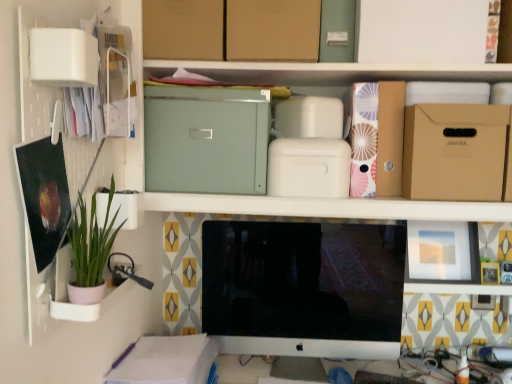
What do you see at coordinates (421, 31) in the screenshot? I see `brown cardboard box at upper right, which appears as the second cardboard box when viewed from the right` at bounding box center [421, 31].

Measure the distance between green matte plant at left and camera.

green matte plant at left and camera are 29.49 inches apart from each other.

Measure the distance between point (252, 49) and camera.

Point (252, 49) and camera are 3.74 feet apart.

Identify the location of matte green metal file cabinet at upper center, the 4th cardboard box positioned from the right. (206, 139).

Where is `white plastic cabinet at upper left`? This screenshot has height=384, width=512. white plastic cabinet at upper left is located at coordinates (116, 79).

Based on their positions, is matte green metal file cabinet at upper center, the 4th cardboard box positioned from the right, located to the left or right of brown cardboard box at upper center, which is the 1th cardboard box from left to right?

Based on their positions, matte green metal file cabinet at upper center, the 4th cardboard box positioned from the right, is located to the right of brown cardboard box at upper center, which is the 1th cardboard box from left to right.

Does point (207, 146) lie behind point (165, 0)?

That is True.

How much distance is there between matte green metal file cabinet at upper center, the second cardboard box from the left, and brown cardboard box at upper center, which is the 1th cardboard box from left to right?

matte green metal file cabinet at upper center, the second cardboard box from the left, and brown cardboard box at upper center, which is the 1th cardboard box from left to right, are 8.34 inches apart from each other.

In terms of width, does matte green metal file cabinet at upper center, the second cardboard box from the left, look wider or thinner when compared to brown cardboard box at upper center, which is the 1th cardboard box from left to right?

Clearly, matte green metal file cabinet at upper center, the second cardboard box from the left, has more width compared to brown cardboard box at upper center, which is the 1th cardboard box from left to right.

Between green matte plant at left and brown cardboard box at upper right, acting as the fourth cardboard box starting from the left, which one has larger width?

brown cardboard box at upper right, acting as the fourth cardboard box starting from the left.

Measure the distance between green matte plant at left and brown cardboard box at upper right, acting as the fourth cardboard box starting from the left.

A distance of 34.48 inches exists between green matte plant at left and brown cardboard box at upper right, acting as the fourth cardboard box starting from the left.

Is green matte plant at left positioned beyond the bounds of brown cardboard box at upper right, acting as the fourth cardboard box starting from the left?

Yes, green matte plant at left is not within brown cardboard box at upper right, acting as the fourth cardboard box starting from the left.

Between green matte plant at left and brown cardboard box at upper right, acting as the fourth cardboard box starting from the left, which one is positioned in front?

green matte plant at left is more forward.

Considering the relative positions of brown cardboard box at upper center, acting as the 5th cardboard box starting from the right, and brown cardboard box at upper center, which is the third cardboard box from left to right, in the image provided, is brown cardboard box at upper center, acting as the 5th cardboard box starting from the right, to the left of brown cardboard box at upper center, which is the third cardboard box from left to right, from the viewer's perspective?

Yes.

Can you confirm if brown cardboard box at upper center, which is the 1th cardboard box from left to right, is smaller than brown cardboard box at upper center, which is the third cardboard box from left to right?

Yes.

Which is in front, brown cardboard box at upper center, which is the 1th cardboard box from left to right, or brown cardboard box at upper center, which is the third cardboard box from left to right?

Positioned in front is brown cardboard box at upper center, which is the third cardboard box from left to right.

Considering the relative positions of brown cardboard box at right, which appears as the 1th cardboard box when viewed from the right, and matte green metal file cabinet at upper center, the 4th cardboard box positioned from the right, in the image provided, is brown cardboard box at right, which appears as the 1th cardboard box when viewed from the right, to the left of matte green metal file cabinet at upper center, the 4th cardboard box positioned from the right, from the viewer's perspective?

In fact, brown cardboard box at right, which appears as the 1th cardboard box when viewed from the right, is to the right of matte green metal file cabinet at upper center, the 4th cardboard box positioned from the right.

Based on the photo, is brown cardboard box at right, which is the 5th cardboard box in left-to-right order, positioned with its back to matte green metal file cabinet at upper center, the 4th cardboard box positioned from the right?

No, brown cardboard box at right, which is the 5th cardboard box in left-to-right order, is not facing away from matte green metal file cabinet at upper center, the 4th cardboard box positioned from the right.

Measure the distance from brown cardboard box at right, which appears as the 1th cardboard box when viewed from the right, to matte green metal file cabinet at upper center, the 4th cardboard box positioned from the right.

brown cardboard box at right, which appears as the 1th cardboard box when viewed from the right, is 21.81 inches from matte green metal file cabinet at upper center, the 4th cardboard box positioned from the right.

Does brown cardboard box at right, which is the 5th cardboard box in left-to-right order, have a larger size compared to matte green metal file cabinet at upper center, the 4th cardboard box positioned from the right?

No, brown cardboard box at right, which is the 5th cardboard box in left-to-right order, is not bigger than matte green metal file cabinet at upper center, the 4th cardboard box positioned from the right.

Is white plastic cabinet at upper left oriented towards brown cardboard box at upper center, acting as the 5th cardboard box starting from the right?

No, white plastic cabinet at upper left is not aimed at brown cardboard box at upper center, acting as the 5th cardboard box starting from the right.

How different are the orientations of white plastic cabinet at upper left and brown cardboard box at upper center, which is the 1th cardboard box from left to right, in degrees?

The angle between the facing direction of white plastic cabinet at upper left and the facing direction of brown cardboard box at upper center, which is the 1th cardboard box from left to right, is 90.7 degrees.

The image size is (512, 384). What are the coordinates of `the 1st cardboard box to the right when counting from the white plastic cabinet at upper left` in the screenshot? It's located at point(184,29).

From a real-world perspective, is white plastic cabinet at upper left beneath brown cardboard box at upper center, acting as the 5th cardboard box starting from the right?

Yes, from a real-world perspective, white plastic cabinet at upper left is under brown cardboard box at upper center, acting as the 5th cardboard box starting from the right.

Is brown cardboard box at upper center, which is the third cardboard box from left to right, positioned with its back to brown cardboard box at upper right, acting as the fourth cardboard box starting from the left?

No, brown cardboard box at upper center, which is the third cardboard box from left to right, is not facing the opposite direction of brown cardboard box at upper right, acting as the fourth cardboard box starting from the left.

Are brown cardboard box at upper center, which is the third cardboard box from left to right, and brown cardboard box at upper right, acting as the fourth cardboard box starting from the left, far apart?

No, there isn't a large distance between brown cardboard box at upper center, which is the third cardboard box from left to right, and brown cardboard box at upper right, acting as the fourth cardboard box starting from the left.

Is brown cardboard box at upper center, acting as the 3th cardboard box starting from the right, wider or thinner than brown cardboard box at upper right, acting as the fourth cardboard box starting from the left?

brown cardboard box at upper center, acting as the 3th cardboard box starting from the right, is thinner than brown cardboard box at upper right, acting as the fourth cardboard box starting from the left.

Where is `cardboard box that is in front of the brown cardboard box at upper center, which is the third cardboard box from left to right`? This screenshot has width=512, height=384. cardboard box that is in front of the brown cardboard box at upper center, which is the third cardboard box from left to right is located at coordinates (421, 31).

Does matte green metal file cabinet at upper center, the second cardboard box from the left, turn towards sleek silver monitor at center?

No, matte green metal file cabinet at upper center, the second cardboard box from the left, is not turned towards sleek silver monitor at center.

Is matte green metal file cabinet at upper center, the second cardboard box from the left, wider than sleek silver monitor at center?

Indeed, matte green metal file cabinet at upper center, the second cardboard box from the left, has a greater width compared to sleek silver monitor at center.

Would you say matte green metal file cabinet at upper center, the 4th cardboard box positioned from the right, is outside sleek silver monitor at center?

Yes, matte green metal file cabinet at upper center, the 4th cardboard box positioned from the right, is located beyond the bounds of sleek silver monitor at center.

Is matte green metal file cabinet at upper center, the 4th cardboard box positioned from the right, with sleek silver monitor at center?

No, matte green metal file cabinet at upper center, the 4th cardboard box positioned from the right, is not beside sleek silver monitor at center.

This screenshot has width=512, height=384. Find the location of `the 3rd cardboard box above when counting from the matte green metal file cabinet at upper center, the second cardboard box from the left (from the image's perspective)`. the 3rd cardboard box above when counting from the matte green metal file cabinet at upper center, the second cardboard box from the left (from the image's perspective) is located at coordinates (184, 29).

Locate an element on the screen. The height and width of the screenshot is (384, 512). plant below the brown cardboard box at upper right, acting as the fourth cardboard box starting from the left (from a real-world perspective) is located at coordinates (92, 241).

When comparing their distances from brown cardboard box at upper right, which appears as the second cardboard box when viewed from the right, does green matte plant at left or brown cardboard box at upper center, acting as the 5th cardboard box starting from the right, seem further?

green matte plant at left.

Based on their spatial positions, is matte green metal file cabinet at upper center, the second cardboard box from the left, or green matte plant at left closer to brown cardboard box at upper center, acting as the 5th cardboard box starting from the right?

Among the two, matte green metal file cabinet at upper center, the second cardboard box from the left, is located nearer to brown cardboard box at upper center, acting as the 5th cardboard box starting from the right.

Which object lies further to the anchor point sleek silver monitor at center, brown cardboard box at upper center, which is the 1th cardboard box from left to right, or white plastic cabinet at upper left?

white plastic cabinet at upper left is positioned further to the anchor sleek silver monitor at center.

Estimate the real-world distances between objects in this image. Which object is further from brown cardboard box at upper center, which is the 1th cardboard box from left to right, green matte plant at left or brown cardboard box at right, which is the 5th cardboard box in left-to-right order?

Based on the image, brown cardboard box at right, which is the 5th cardboard box in left-to-right order, appears to be further to brown cardboard box at upper center, which is the 1th cardboard box from left to right.

Which object lies nearer to the anchor point white plastic cabinet at upper left, matte green metal file cabinet at upper center or sleek silver monitor at center?

matte green metal file cabinet at upper center is closer to white plastic cabinet at upper left.

Looking at the image, which one is located further to brown cardboard box at upper center, which is the third cardboard box from left to right, brown cardboard box at upper right, acting as the fourth cardboard box starting from the left, or brown cardboard box at right, which is the 5th cardboard box in left-to-right order?

brown cardboard box at right, which is the 5th cardboard box in left-to-right order, is positioned further to the anchor brown cardboard box at upper center, which is the third cardboard box from left to right.

Looking at the image, which one is located further to matte green metal file cabinet at upper center, the second cardboard box from the left, brown cardboard box at right, which appears as the 1th cardboard box when viewed from the right, or white plastic cabinet at upper left?

The object further to matte green metal file cabinet at upper center, the second cardboard box from the left, is brown cardboard box at right, which appears as the 1th cardboard box when viewed from the right.

From the picture: From the image, which object appears to be farther from brown cardboard box at upper center, which is the third cardboard box from left to right, brown cardboard box at upper right, which appears as the second cardboard box when viewed from the right, or sleek silver monitor at center?

Among the two, sleek silver monitor at center is located further to brown cardboard box at upper center, which is the third cardboard box from left to right.

Locate an element on the screen. cardboard box between brown cardboard box at upper center, acting as the 3th cardboard box starting from the right, and brown cardboard box at right, which appears as the 1th cardboard box when viewed from the right is located at coordinates (421, 31).

At what (x,y) coordinates should I click in order to perform the action: click on storage box situated between brown cardboard box at upper center, acting as the 3th cardboard box starting from the right, and brown cardboard box at right, which appears as the 1th cardboard box when viewed from the right, from left to right. Please return your answer as a coordinate pair (x, y). This screenshot has width=512, height=384. Looking at the image, I should click on (337, 31).

The height and width of the screenshot is (384, 512). Identify the location of plant that lies between brown cardboard box at upper right, acting as the fourth cardboard box starting from the left, and sleek silver monitor at center from top to bottom. (92, 241).

Where is `plant between brown cardboard box at upper center, which is the 1th cardboard box from left to right, and sleek silver monitor at center in the up-down direction`? Image resolution: width=512 pixels, height=384 pixels. plant between brown cardboard box at upper center, which is the 1th cardboard box from left to right, and sleek silver monitor at center in the up-down direction is located at coordinates (92, 241).